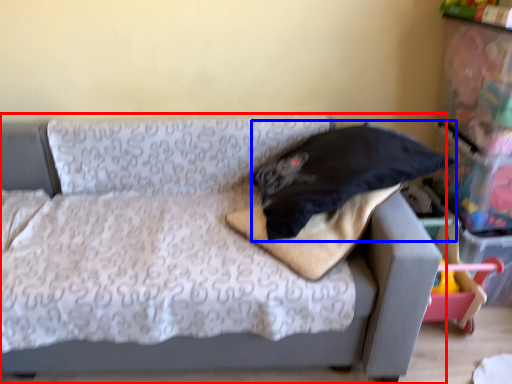
Question: Which object appears closest to the camera in this image, studio couch (highlighted by a red box) or pillow (highlighted by a blue box)?

Choices:
 (A) studio couch
 (B) pillow

Answer: (A)